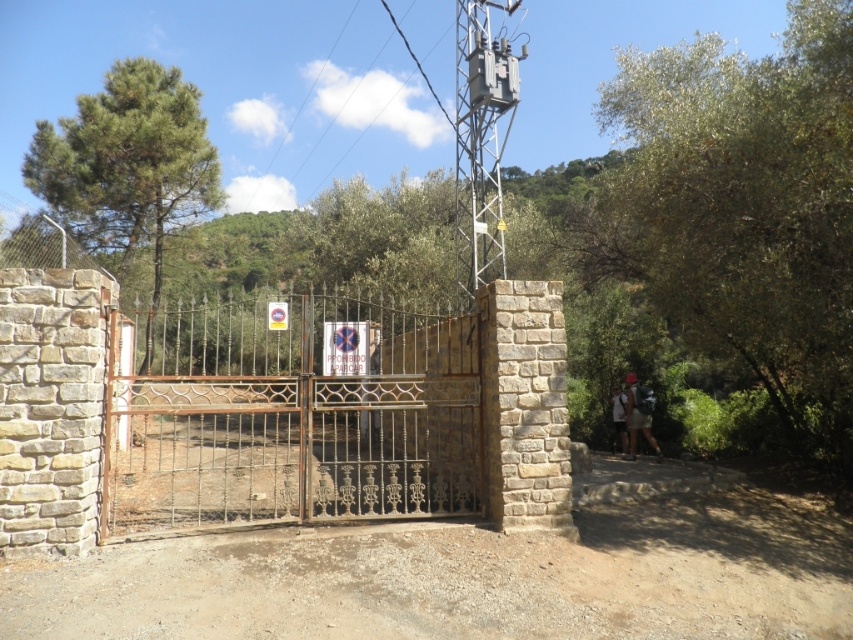
Question: Can you confirm if matte red backpack at right is smaller than white fabric shirt at center?

Choices:
 (A) yes
 (B) no

Answer: (B)

Question: Which point appears closest to the camera in this image?

Choices:
 (A) (637, 417)
 (B) (363, 307)
 (C) (624, 419)

Answer: (A)

Question: Can you confirm if green leafy tree at upper left is thinner than matte red backpack at right?

Choices:
 (A) yes
 (B) no

Answer: (A)

Question: Among these points, which one is nearest to the camera?

Choices:
 (A) (630, 401)
 (B) (619, 396)
 (C) (119, 253)
 (D) (786, 100)

Answer: (D)

Question: Can you confirm if rusty metal gate at center is thinner than matte red backpack at right?

Choices:
 (A) yes
 (B) no

Answer: (B)

Question: Which point is farther to the camera?

Choices:
 (A) (648, 392)
 (B) (614, 416)
 (C) (172, 67)
 (D) (399, 330)

Answer: (C)